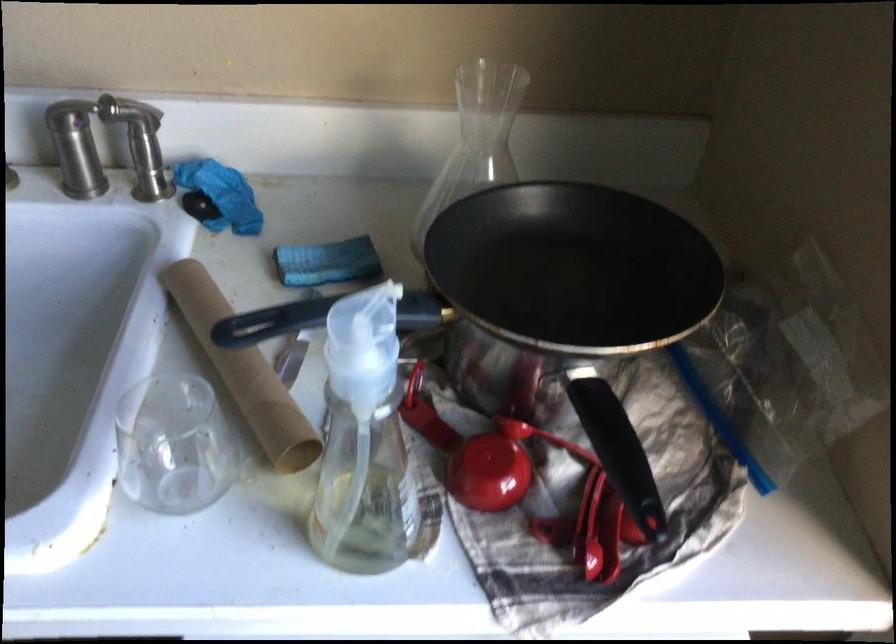
Where would you push the faucet handle? Please return your answer as a coordinate pair (x, y).

(140, 144)